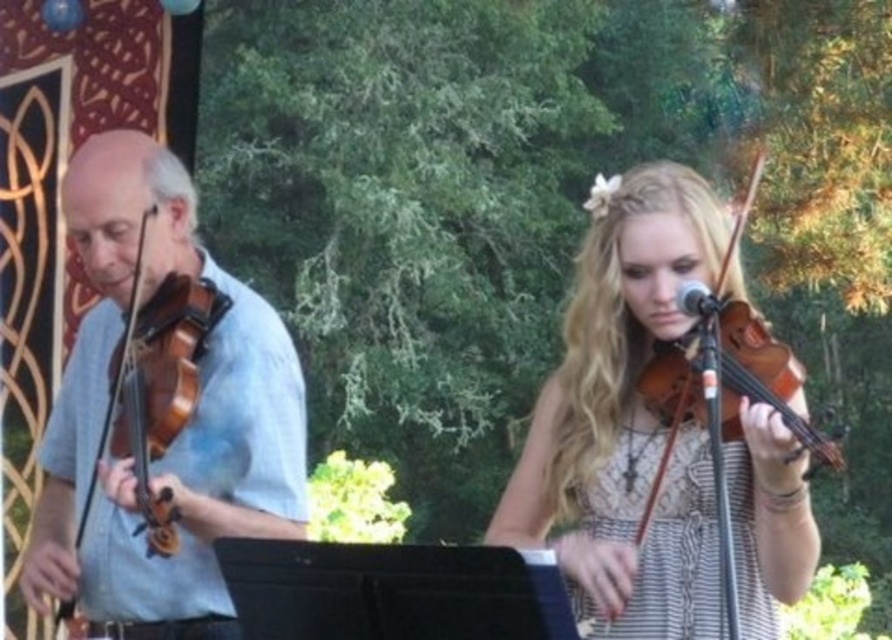
Is matte brown violin at center in front of matte brown violin at left?

Yes, it is in front of matte brown violin at left.

Where is `matte brown violin at center`? matte brown violin at center is located at coordinates (626, 417).